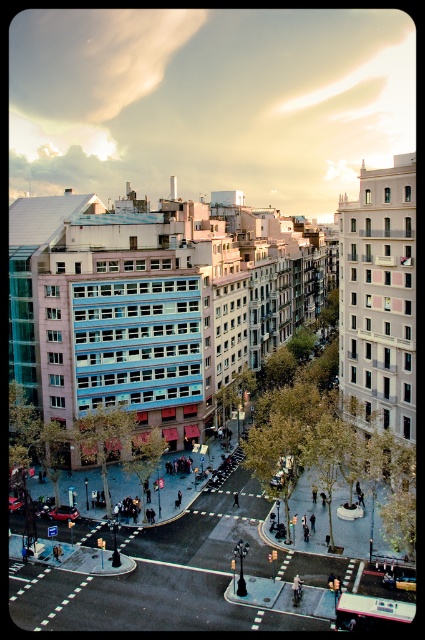
Does metallic silver car at center appear on the right side of metallic red car at center?

Correct, you'll find metallic silver car at center to the right of metallic red car at center.

You are a GUI agent. You are given a task and a screenshot of the screen. Output one action in this format:
    pyautogui.click(x=<x>, y=<y>)
    Task: Click on the metallic silver car at center
    
    Given the screenshot: What is the action you would take?
    pyautogui.click(x=64, y=513)